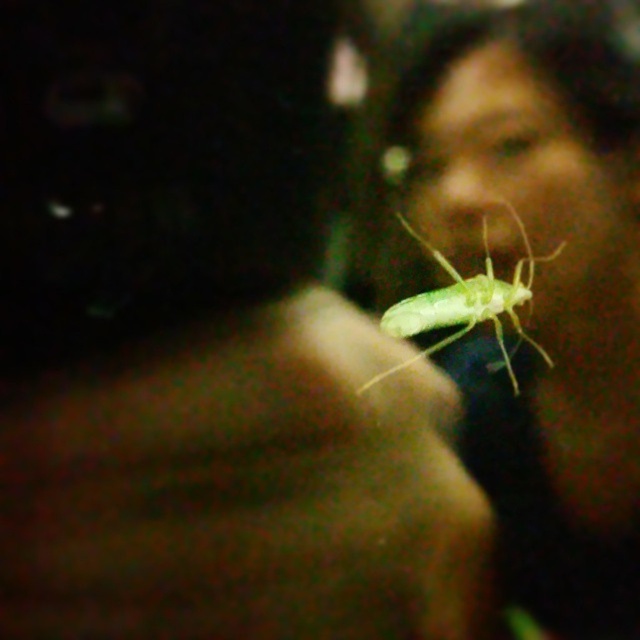
Consider the image. You are a researcher holding a magnifying glass and observing two green translucent insects in the image. You need to determine if the space between them is sufficient to fit a 3.5 inch long measurement tool without disturbing them. Can the tool fit between the green translucent insect at upper right and the green translucent insect at center?

→ The distance between the green translucent insect at upper right and the green translucent insect at center is 3.25 inches. Since the tool is 3.5 inches long, it cannot fit between them without overlapping the insects.